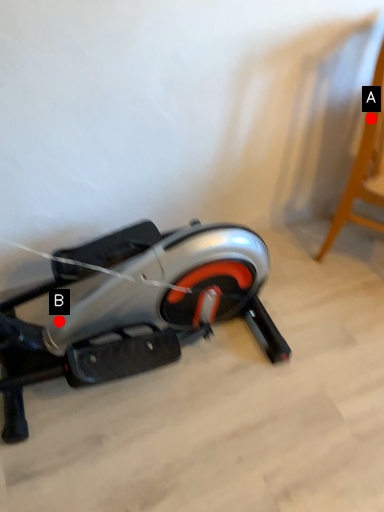
Question: Two points are circled on the image, labeled by A and B beside each circle. Which point is further to the camera?

Choices:
 (A) A is further
 (B) B is further

Answer: (A)